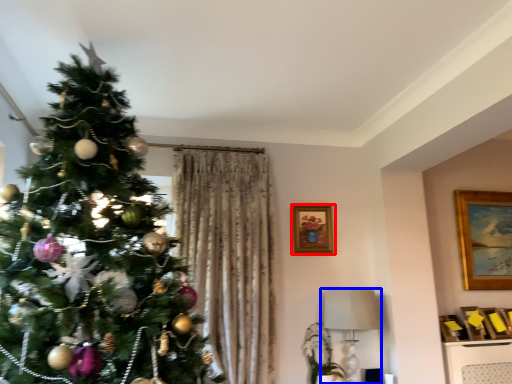
Question: Among these objects, which one is farthest to the camera, picture frame (highlighted by a red box) or lamp (highlighted by a blue box)?

Choices:
 (A) picture frame
 (B) lamp

Answer: (A)